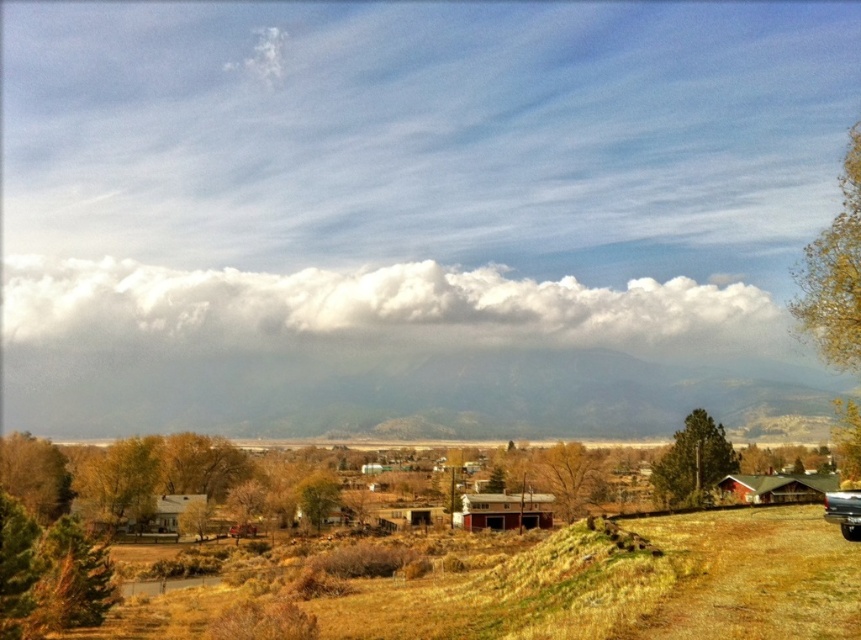
Describe the element at coordinates (375, 308) in the screenshot. I see `white fluffy cloud at upper center` at that location.

Can you confirm if white fluffy cloud at upper center is positioned above shiny silver truck at lower right?

Correct, white fluffy cloud at upper center is located above shiny silver truck at lower right.

Identify the location of white fluffy cloud at upper center. (375, 308).

Does white fluffy cloud at upper center have a greater width compared to brown textured tree at center?

Yes.

Is white fluffy cloud at upper center below brown textured tree at center?

Incorrect, white fluffy cloud at upper center is not positioned below brown textured tree at center.

Locate an element on the screen. white fluffy cloud at upper center is located at coordinates (375, 308).

Identify the location of white fluffy cloud at upper center. (375, 308).

Is yellow leafy tree at lower left taller than green matte tree at center?

Yes.

Does yellow leafy tree at lower left have a greater width compared to green matte tree at center?

Indeed, yellow leafy tree at lower left has a greater width compared to green matte tree at center.

Describe the element at coordinates (119, 483) in the screenshot. The width and height of the screenshot is (861, 640). I see `yellow leafy tree at lower left` at that location.

Identify the location of yellow leafy tree at lower left. (119, 483).